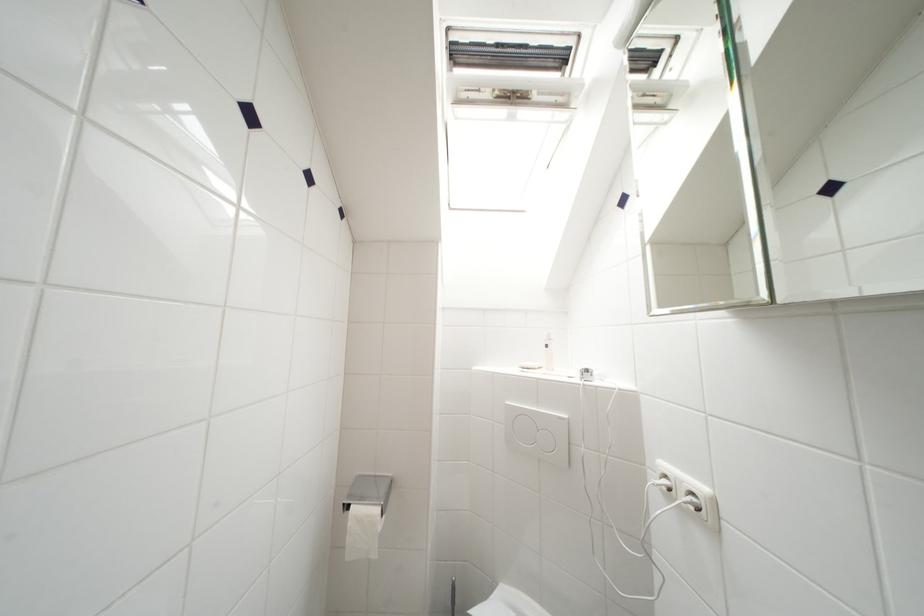
Where would you pull the white electrical plug? Please return your answer as a coordinate pair (x, y).

(677, 492)